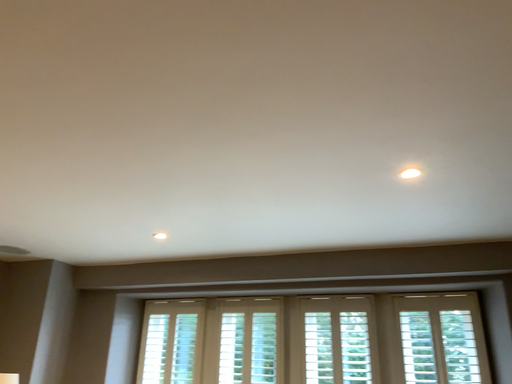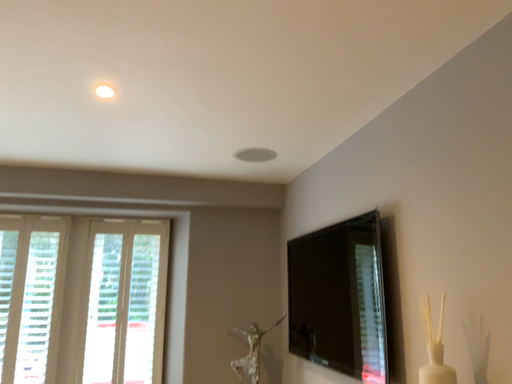
Question: Which way did the camera rotate in the video?

Choices:
 (A) rotated upward
 (B) rotated downward

Answer: (B)